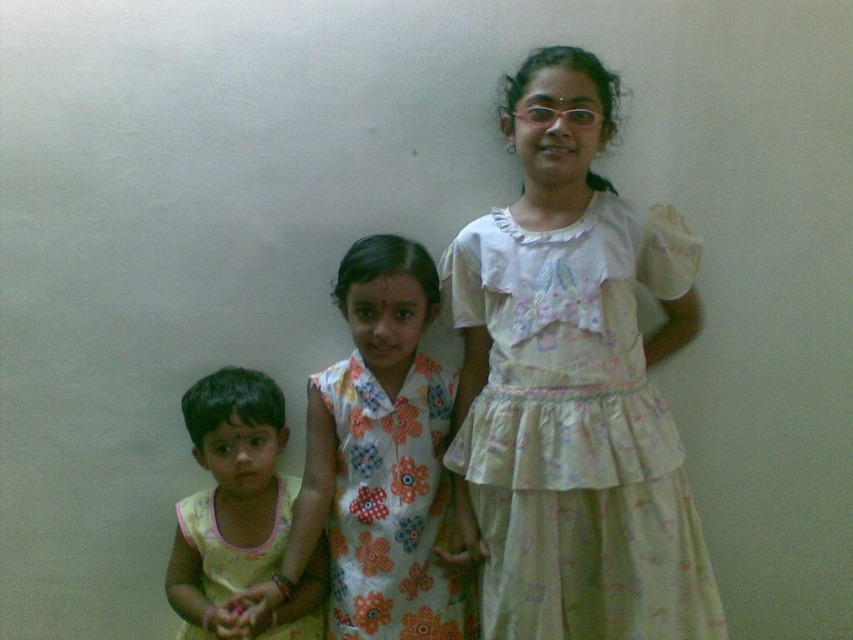
Who is shorter, white satin dress at upper right or yellow cotton dress at lower left?

With less height is yellow cotton dress at lower left.

Which is behind, point (485, 541) or point (222, 522)?

Positioned behind is point (222, 522).

Locate an element on the screen. This screenshot has width=853, height=640. white satin dress at upper right is located at coordinates (577, 429).

Where is `white satin dress at upper right`? The image size is (853, 640). white satin dress at upper right is located at coordinates (x=577, y=429).

Measure the distance between white satin dress at upper right and camera.

white satin dress at upper right and camera are 4.51 feet apart.

This screenshot has width=853, height=640. Find the location of `white satin dress at upper right`. white satin dress at upper right is located at coordinates (577, 429).

Who is more forward, (424, 557) or (329, 406)?

Point (424, 557)

Is point (357, 314) behind point (418, 579)?

No.

Who is more distant from viewer, (403, 480) or (360, 412)?

Positioned behind is point (360, 412).

What are the coordinates of `floral dress at center` in the screenshot? It's located at (378, 461).